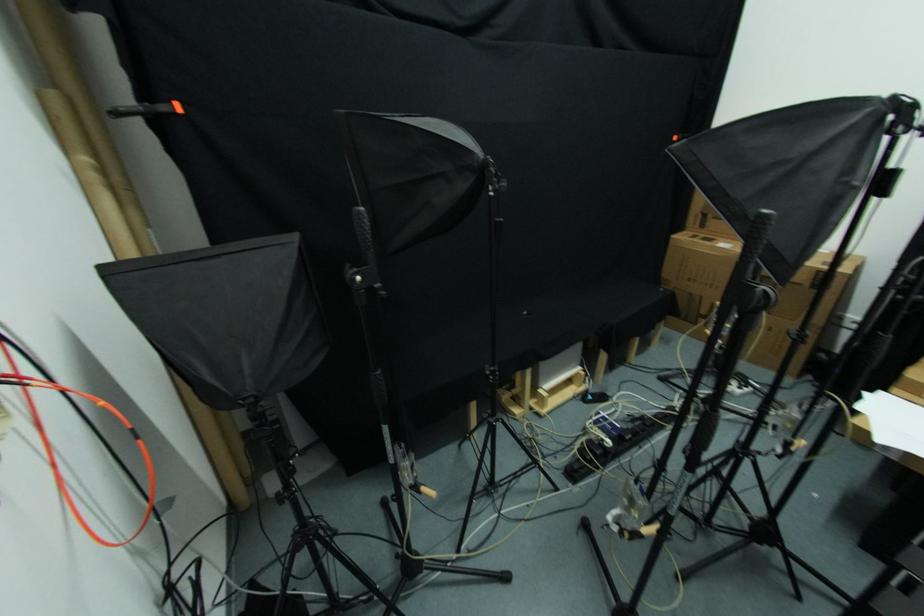
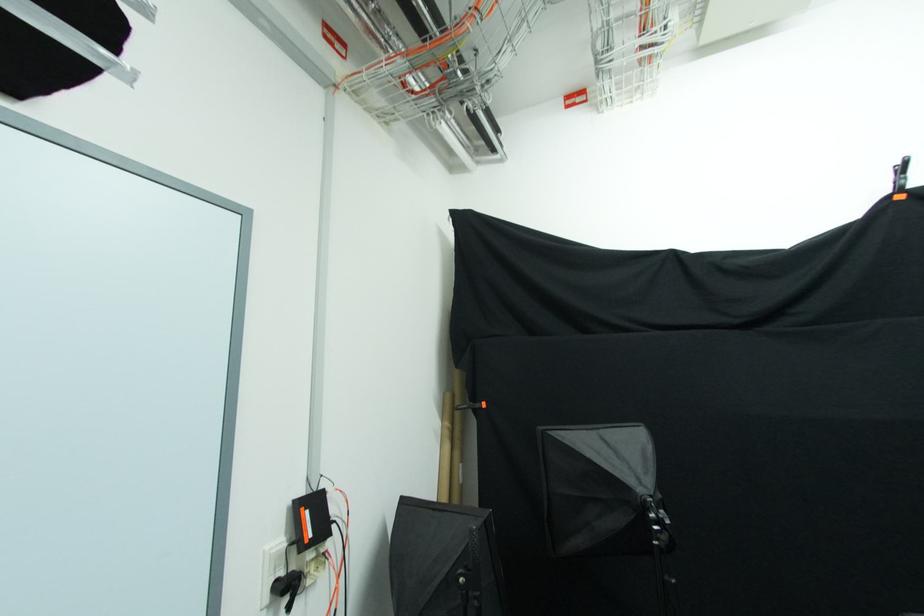
Find the pixel in the second image that matches (x=91, y=163) in the first image.

(448, 427)